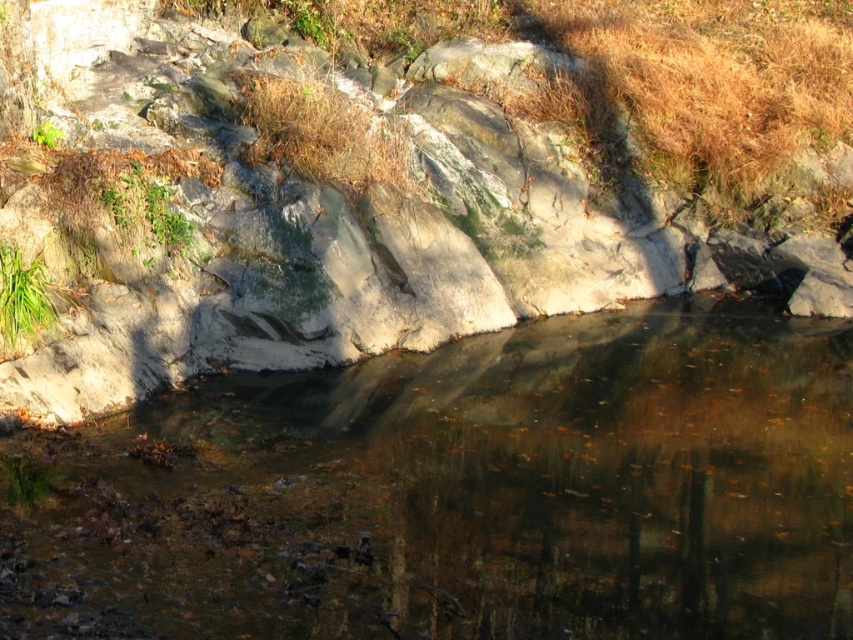
Can you confirm if clear water at center is positioned to the left of green grass at lower left?

Incorrect, clear water at center is not on the left side of green grass at lower left.

Is clear water at center positioned at the back of green grass at lower left?

No, it is in front of green grass at lower left.

Does point (759, 548) lie in front of point (10, 296)?

Yes, it is in front of point (10, 296).

The image size is (853, 640). I want to click on clear water at center, so click(x=460, y=492).

What do you see at coordinates (409, 182) in the screenshot?
I see `rough stone hillside at upper center` at bounding box center [409, 182].

Who is lower down, rough stone hillside at upper center or clear water at center?

clear water at center is below.

Find the location of a particular element. rough stone hillside at upper center is located at coordinates (409, 182).

Between point (241, 209) and point (39, 285), which one is positioned in front?

Point (39, 285) is more forward.

Consider the image. Does rough stone hillside at upper center have a greater height compared to green grass at lower left?

Correct, rough stone hillside at upper center is much taller as green grass at lower left.

Is point (581, 202) positioned in front of point (38, 312)?

No, (581, 202) is further to viewer.

Find the location of a particular element. rough stone hillside at upper center is located at coordinates (409, 182).